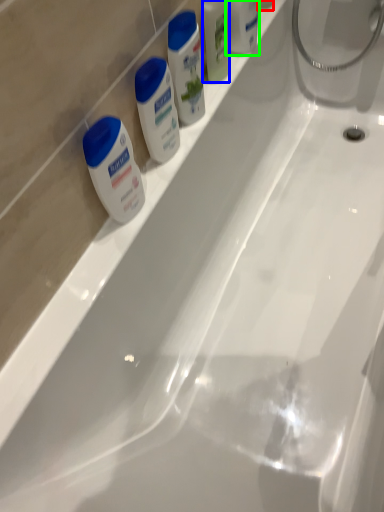
Question: Estimate the real-world distances between objects in this image. Which object is closer to toiletry (highlighted by a red box), mouthwash (highlighted by a blue box) or toiletry (highlighted by a green box)?

Choices:
 (A) mouthwash
 (B) toiletry

Answer: (B)